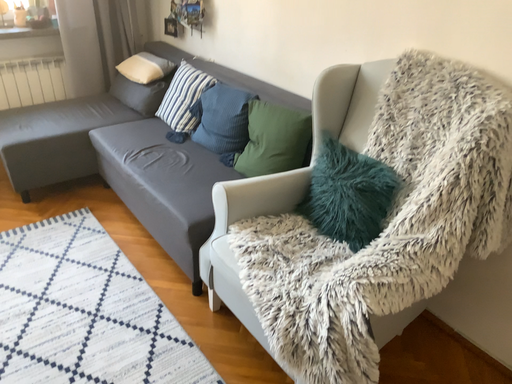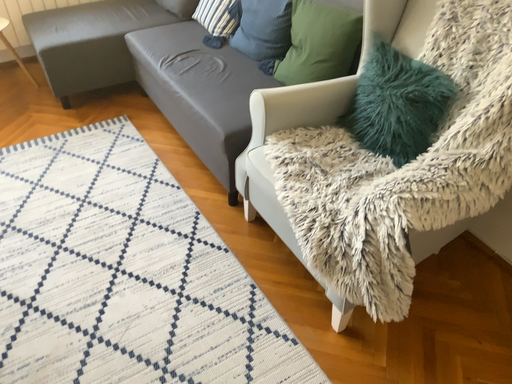
Question: Which way did the camera rotate in the video?

Choices:
 (A) rotated upward
 (B) rotated downward

Answer: (B)